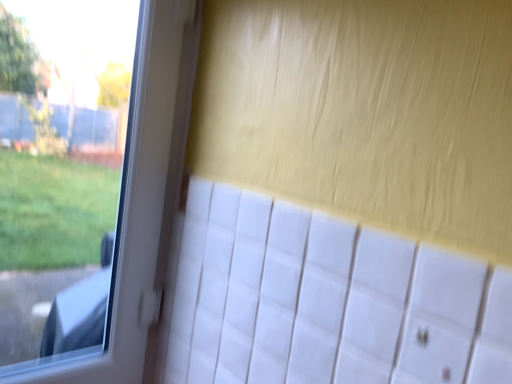
Describe the element at coordinates (140, 200) in the screenshot. I see `transparent glass window at left` at that location.

This screenshot has height=384, width=512. I want to click on transparent glass window at left, so click(x=140, y=200).

What is the approximate height of transparent glass window at left?

transparent glass window at left is 1.06 meters tall.

Find the location of a particular element. transparent glass window at left is located at coordinates point(140,200).